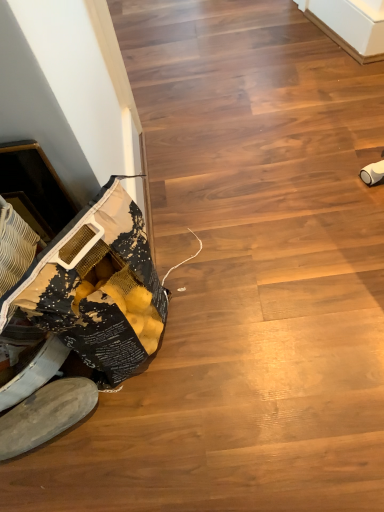
The height and width of the screenshot is (512, 384). Identify the location of free space above white suede shoe at lower left (from a real-world perspective). (38, 413).